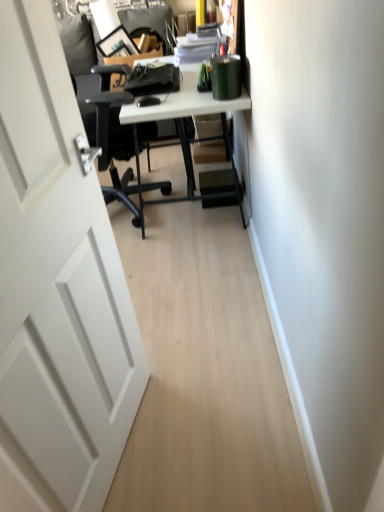
Identify the location of vacant area situated below white matte door at left (from a real-world perspective). The height and width of the screenshot is (512, 384). [131, 436].